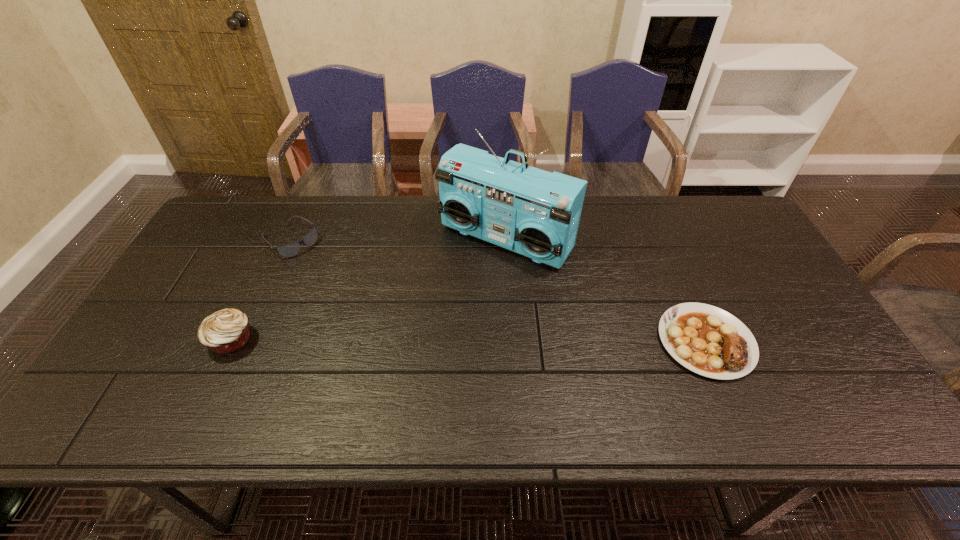
Where is `empty space that is in between the sunglasses and the steak`? The width and height of the screenshot is (960, 540). empty space that is in between the sunglasses and the steak is located at coordinates (498, 291).

The width and height of the screenshot is (960, 540). Identify the location of unoccupied position between the sunglasses and the second object from right to left. (398, 240).

Locate an element on the screen. The height and width of the screenshot is (540, 960). the closest object relative to the muffin is located at coordinates (288, 250).

Choose which object is the nearest neighbor to the second object from right to left. Please provide its 2D coordinates. Your answer should be formatted as a tuple, i.e. [(x, y)], where the tuple contains the x and y coordinates of a point satisfying the conditions above.

[(707, 340)]

Identify the location of vacant area that satisfies the following two spatial constraints: 1. on the back side of the muffin; 2. on the left side of the radio receiver. This screenshot has width=960, height=540. (280, 239).

Locate an element on the screen. This screenshot has height=540, width=960. free location that satisfies the following two spatial constraints: 1. on the back side of the radio receiver; 2. on the right side of the muffin is located at coordinates (280, 239).

The image size is (960, 540). I want to click on vacant space that satisfies the following two spatial constraints: 1. on the front side of the rightmost object; 2. on the left side of the second tallest object, so click(231, 341).